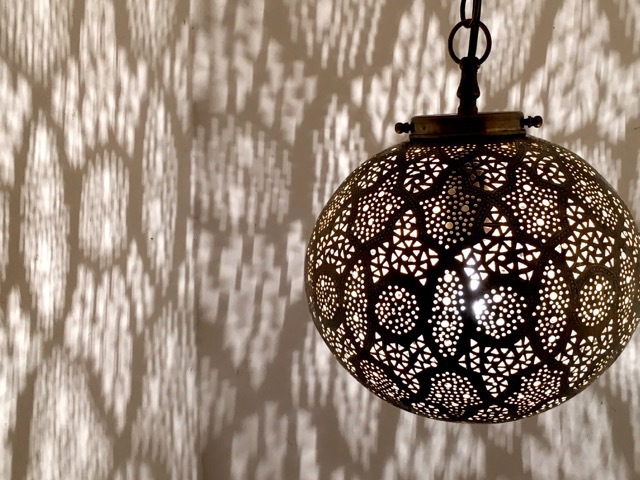
You are a GUI agent. You are given a task and a screenshot of the screen. Output one action in this format:
    pyautogui.click(x=<x>, y=<y>)
    Task: Click on the chandelier
    This screenshot has height=480, width=640.
    Given the screenshot: What is the action you would take?
    pyautogui.click(x=477, y=228)